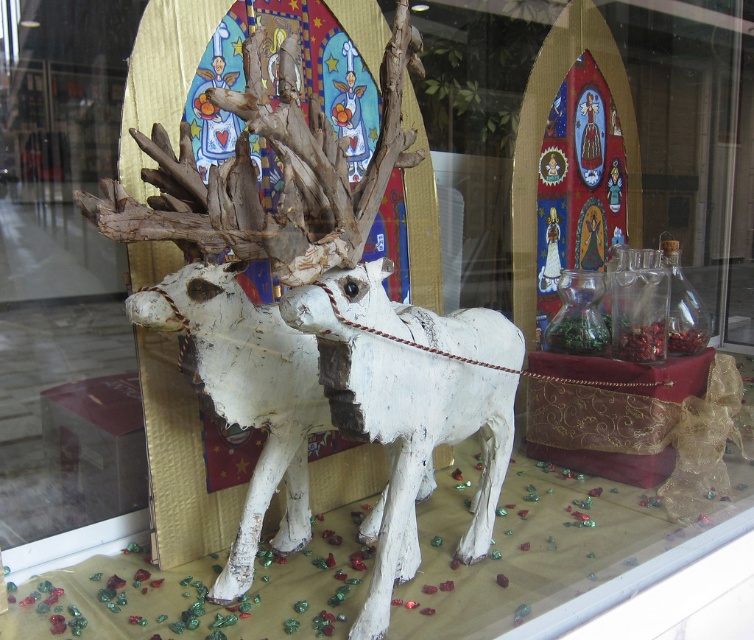
Is the position of white matte reindeer at center less distant than that of white painted wood reindeer at center?

Yes, it is in front of white painted wood reindeer at center.

Describe the element at coordinates (409, 406) in the screenshot. I see `white matte reindeer at center` at that location.

You are a GUI agent. You are given a task and a screenshot of the screen. Output one action in this format:
    pyautogui.click(x=<x>, y=<y>)
    Task: Click on the white matte reindeer at center
    
    Given the screenshot: What is the action you would take?
    pyautogui.click(x=409, y=406)